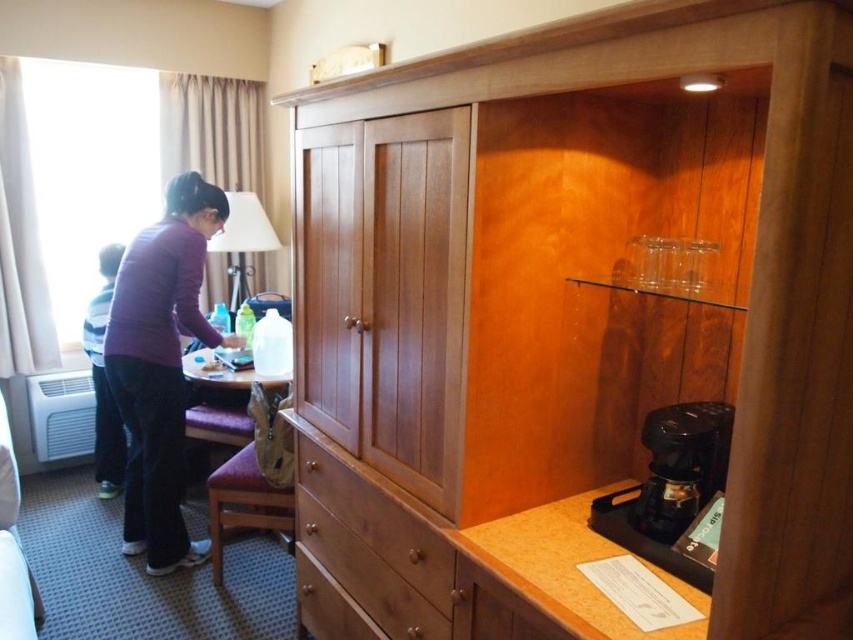
Question: Which point is farther to the camera?

Choices:
 (A) purple fabric stool at lower center
 (B) black plastic coffee machine at lower right
 (C) purple cotton shirt at left
 (D) purple fabric shirt at left

Answer: (D)

Question: Which object appears closest to the camera in this image?

Choices:
 (A) black plastic coffee machine at lower right
 (B) matte white lampshade at upper left
 (C) purple fabric stool at lower center

Answer: (A)

Question: Is brown wood drawer at center below black plastic coffee machine at lower right?

Choices:
 (A) no
 (B) yes

Answer: (B)

Question: Is the position of purple cotton shirt at left less distant than that of brown leather stool at lower center?

Choices:
 (A) yes
 (B) no

Answer: (A)

Question: Which point is closer to the camera taking this photo?

Choices:
 (A) (113, 401)
 (B) (227, 426)
 (C) (241, 237)

Answer: (B)

Question: Where is wooden dresser at center located in relation to black plastic coffee machine at lower right in the image?

Choices:
 (A) below
 (B) above

Answer: (B)